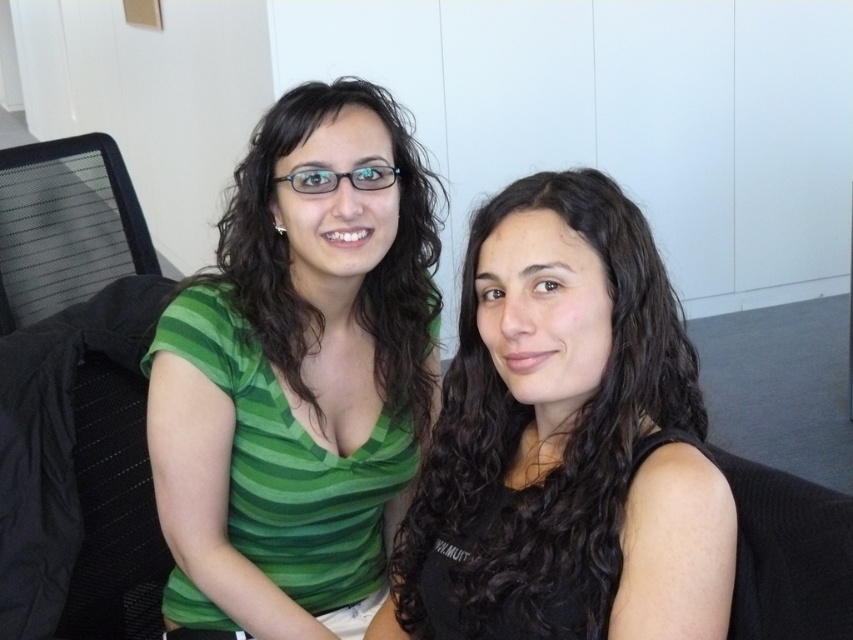
What do you see at coordinates (297, 371) in the screenshot? Image resolution: width=853 pixels, height=640 pixels. I see `green striped shirt at center` at bounding box center [297, 371].

Is point (190, 435) more distant than point (685, 564)?

Yes, point (190, 435) is behind point (685, 564).

The image size is (853, 640). I want to click on green striped shirt at center, so click(x=297, y=371).

Locate an element on the screen. green striped shirt at center is located at coordinates (297, 371).